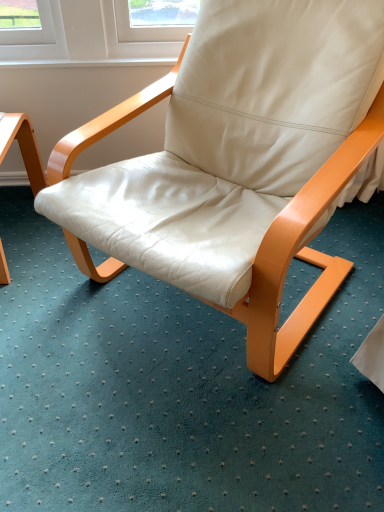
Image resolution: width=384 pixels, height=512 pixels. I want to click on free space in front of white leather chair at center, so click(x=206, y=429).